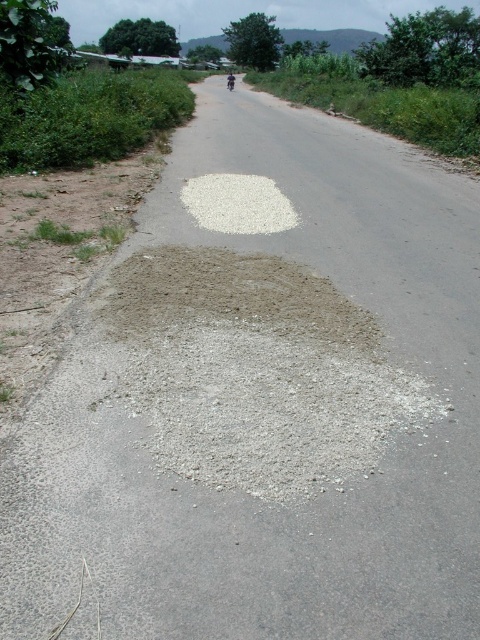
Question: Which point is closer to the camera?

Choices:
 (A) (227, 84)
 (B) (262, 212)

Answer: (B)

Question: Can you confirm if white gravel at center is bigger than metallic silver motorcycle at center?

Choices:
 (A) yes
 (B) no

Answer: (B)

Question: Which object is the farthest from the metallic silver motorcycle at center?

Choices:
 (A) gray gravel at center
 (B) white gravel at center

Answer: (A)

Question: Is gray gravel at center bigger than white gravel at center?

Choices:
 (A) yes
 (B) no

Answer: (B)

Question: Which object is the closest to the metallic silver motorcycle at center?

Choices:
 (A) gray gravel at center
 (B) white gravel at center

Answer: (B)

Question: Does gray gravel at center have a larger size compared to metallic silver motorcycle at center?

Choices:
 (A) no
 (B) yes

Answer: (A)